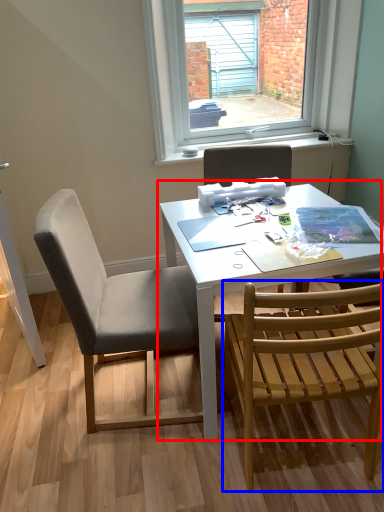
Question: Which of the following is the closest to the observer, table (highlighted by a red box) or chair (highlighted by a blue box)?

Choices:
 (A) table
 (B) chair

Answer: (B)